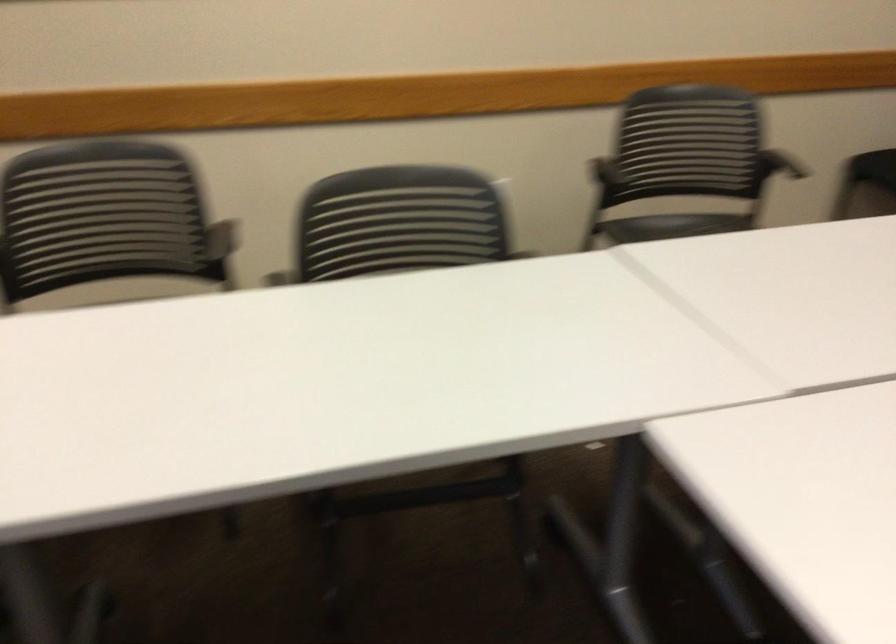
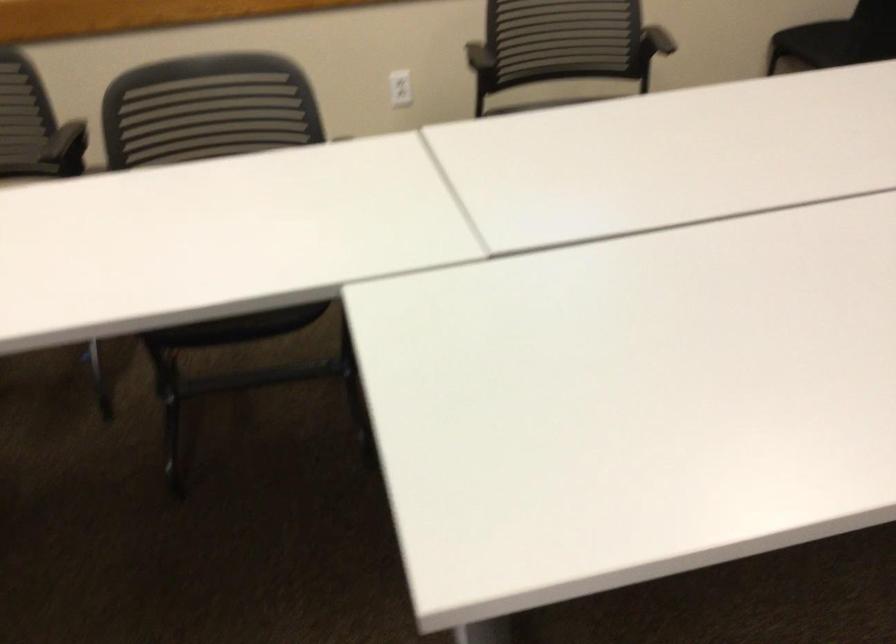
The point at (213, 249) is marked in the first image. Where is the corresponding point in the second image?

(67, 149)